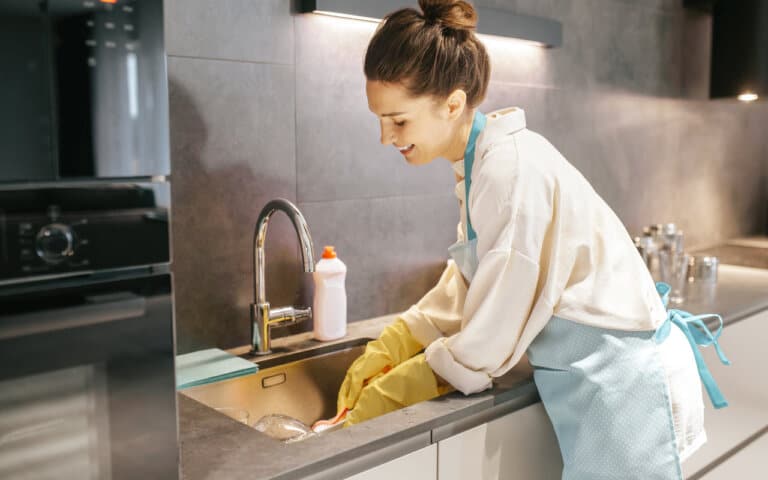
Where is `bottle`? bottle is located at coordinates (338, 309).